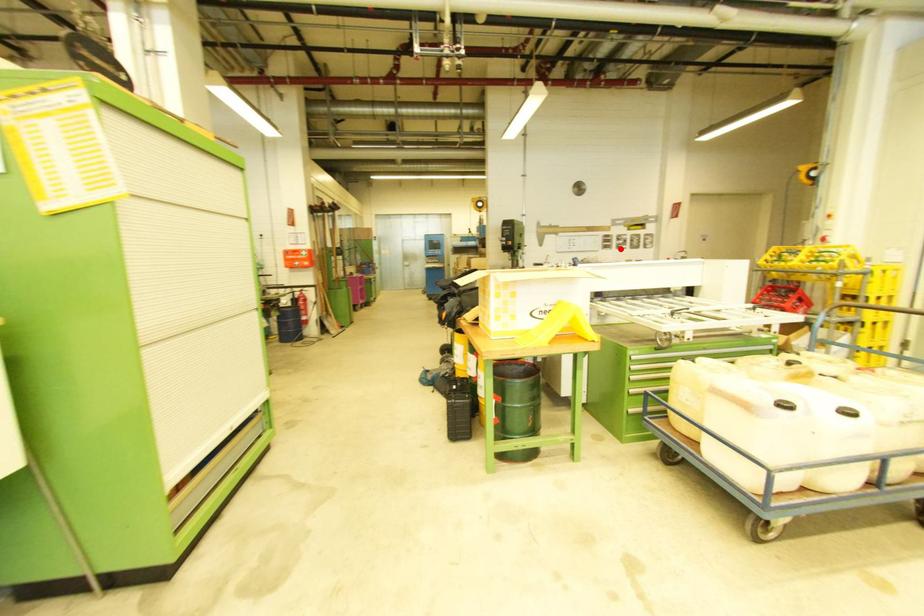
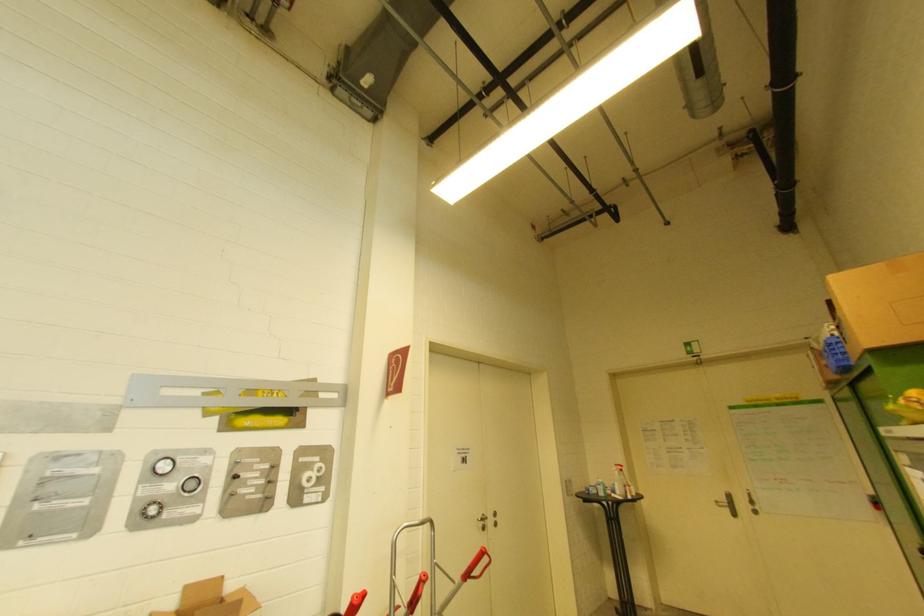
In the second image, find the point that corresponds to the highlighted location in the first image.

(149, 517)